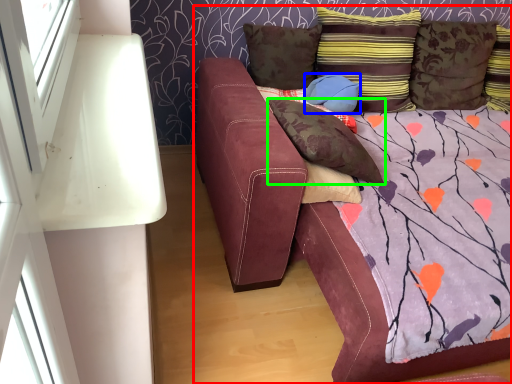
Question: Which object is the farthest from studio couch (highlighted by a red box)? Choose among these: pillow (highlighted by a blue box) or pillow (highlighted by a green box).

Choices:
 (A) pillow
 (B) pillow

Answer: (A)